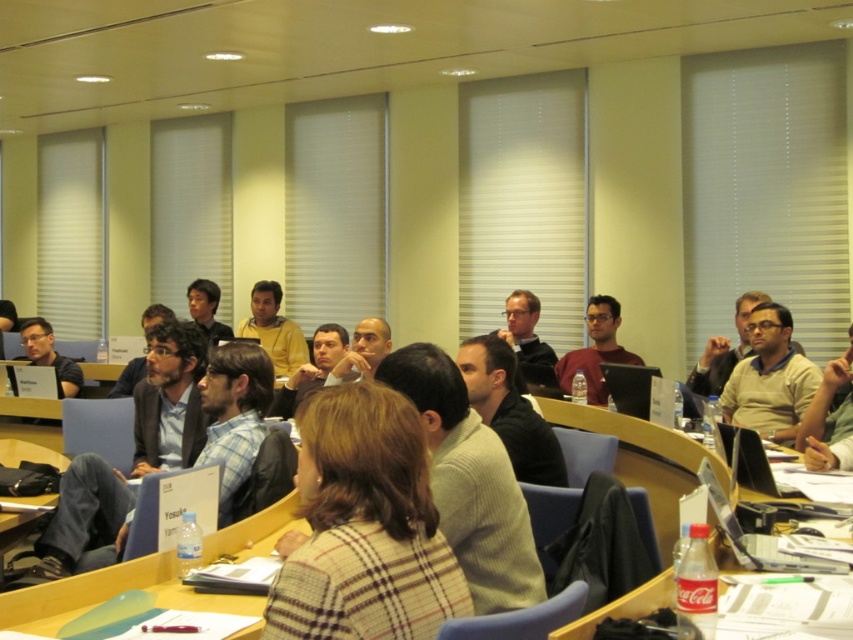
Looking at this image, which is more to the left, white paper at center or yellow sweater at center?

yellow sweater at center is more to the left.

The image size is (853, 640). Describe the element at coordinates (648, 460) in the screenshot. I see `white paper at center` at that location.

Identify the location of white paper at center. The image size is (853, 640). click(648, 460).

Is white paper at center bigger than matte black laptop at center?

Indeed, white paper at center has a larger size compared to matte black laptop at center.

Is point (592, 422) farther from viewer compared to point (612, 317)?

No, (592, 422) is in front of (612, 317).

At what (x,y) coordinates should I click in order to perform the action: click on white paper at center. Please return your answer as a coordinate pair (x, y). Looking at the image, I should click on (648, 460).

Does white paper at center appear on the right side of matte beige sweater at center?

No, white paper at center is not to the right of matte beige sweater at center.

Measure the distance between white paper at center and camera.

→ white paper at center is 2.60 meters away from camera.

Where is `white paper at center`? This screenshot has width=853, height=640. white paper at center is located at coordinates (648, 460).